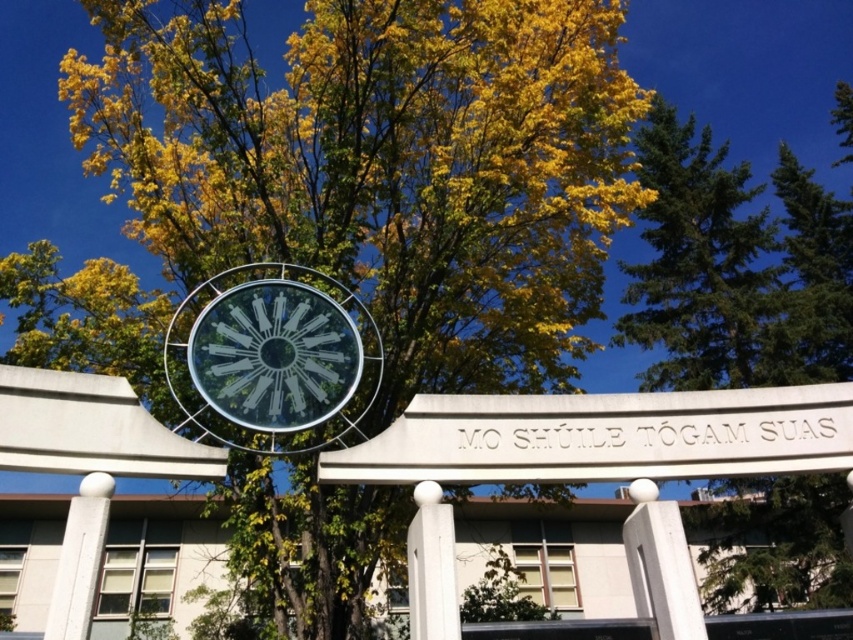
Can you confirm if green leafy tree at upper right is bigger than white concrete pillar at lower left?

Yes.

Which is in front, point (672, 145) or point (103, 484)?

Point (103, 484) is in front.

I want to click on green leafy tree at upper right, so click(x=735, y=268).

Which of these two, transparent glass clock at center or white concrete pillar at lower left, stands shorter?

With less height is white concrete pillar at lower left.

Which is behind, point (225, 320) or point (85, 484)?

The point (225, 320) is more distant.

The image size is (853, 640). Identify the location of transparent glass clock at center. (274, 355).

You are a GUI agent. You are given a task and a screenshot of the screen. Output one action in this format:
    pyautogui.click(x=<x>, y=<y>)
    Task: Click on the transparent glass clock at center
    The image size is (853, 640).
    Given the screenshot: What is the action you would take?
    pyautogui.click(x=274, y=355)

Between transparent glass clock at center and white glossy pillar at center, which one appears on the right side from the viewer's perspective?

white glossy pillar at center is more to the right.

Can you confirm if transparent glass clock at center is smaller than white glossy pillar at center?

Actually, transparent glass clock at center might be larger than white glossy pillar at center.

Which is behind, point (314, 404) or point (422, 566)?

The point (314, 404) is behind.

You are a GUI agent. You are given a task and a screenshot of the screen. Output one action in this format:
    pyautogui.click(x=<x>, y=<y>)
    Task: Click on the transparent glass clock at center
    The image size is (853, 640).
    Given the screenshot: What is the action you would take?
    pyautogui.click(x=274, y=355)